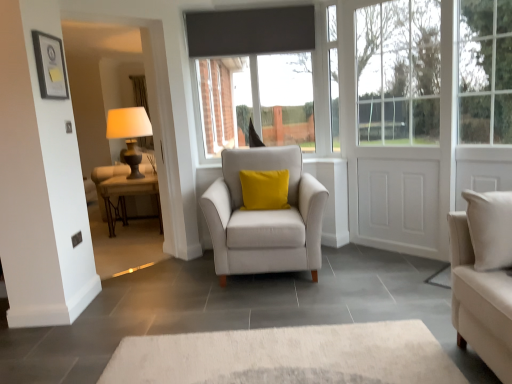
Question: Can you confirm if white plastic window frame at upper right is thinner than matte black picture frame at upper left?

Choices:
 (A) no
 (B) yes

Answer: (A)

Question: From the image's perspective, is white plastic window frame at upper right beneath matte black picture frame at upper left?

Choices:
 (A) yes
 (B) no

Answer: (B)

Question: Can you confirm if white plastic window frame at upper right is shorter than matte black picture frame at upper left?

Choices:
 (A) no
 (B) yes

Answer: (A)

Question: Is white plastic window frame at upper right to the right of matte black picture frame at upper left from the viewer's perspective?

Choices:
 (A) no
 (B) yes

Answer: (B)

Question: Is white plastic window frame at upper right far away from matte black picture frame at upper left?

Choices:
 (A) no
 (B) yes

Answer: (B)

Question: From a real-world perspective, is white plastic window frame at upper right over matte black picture frame at upper left?

Choices:
 (A) no
 (B) yes

Answer: (A)

Question: Is white matte door at right next to white plastic window frame at upper right and touching it?

Choices:
 (A) yes
 (B) no

Answer: (B)

Question: Is white matte door at right outside white plastic window frame at upper right?

Choices:
 (A) yes
 (B) no

Answer: (A)

Question: Considering the relative positions of white matte door at right and white plastic window frame at upper right in the image provided, is white matte door at right to the right of white plastic window frame at upper right from the viewer's perspective?

Choices:
 (A) no
 (B) yes

Answer: (B)

Question: From the image's perspective, is white matte door at right beneath white plastic window frame at upper right?

Choices:
 (A) no
 (B) yes

Answer: (B)

Question: Is white matte door at right bigger than white plastic window frame at upper right?

Choices:
 (A) no
 (B) yes

Answer: (B)

Question: Does white matte door at right come behind white plastic window frame at upper right?

Choices:
 (A) yes
 (B) no

Answer: (B)

Question: Is white matte door at right surrounded by matte black table at left?

Choices:
 (A) yes
 (B) no

Answer: (B)